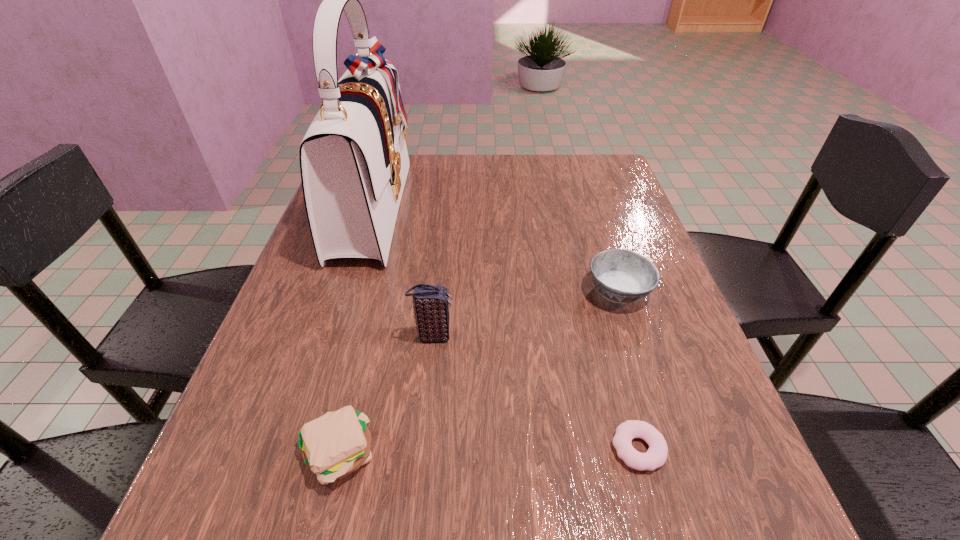
In the image, there is a desktop. Identify the location of vacant space at the near edge. Image resolution: width=960 pixels, height=540 pixels. (394, 535).

What are the coordinates of `blank space at the left edge of the desktop` in the screenshot? It's located at (272, 393).

The image size is (960, 540). Find the location of `vacant area at the right edge of the desktop`. vacant area at the right edge of the desktop is located at coordinates (726, 406).

Image resolution: width=960 pixels, height=540 pixels. Identify the location of blank space at the far right corner of the desktop. (612, 158).

I want to click on free space between the third object from left to right and the tallest object, so click(402, 272).

This screenshot has width=960, height=540. What are the coordinates of `free spot between the tallest object and the shortest object` in the screenshot? It's located at (505, 328).

At what (x,y) coordinates should I click in order to perform the action: click on vacant space that is in between the satchel and the ashtray. Please return your answer as a coordinate pair (x, y). The height and width of the screenshot is (540, 960). Looking at the image, I should click on (495, 249).

Locate an element on the screen. vacant space that's between the satchel and the clutch bag is located at coordinates (402, 272).

Find the location of `free space between the patty and the tallest object`. free space between the patty and the tallest object is located at coordinates (355, 331).

The width and height of the screenshot is (960, 540). I want to click on free space between the satchel and the second tallest object, so click(x=402, y=272).